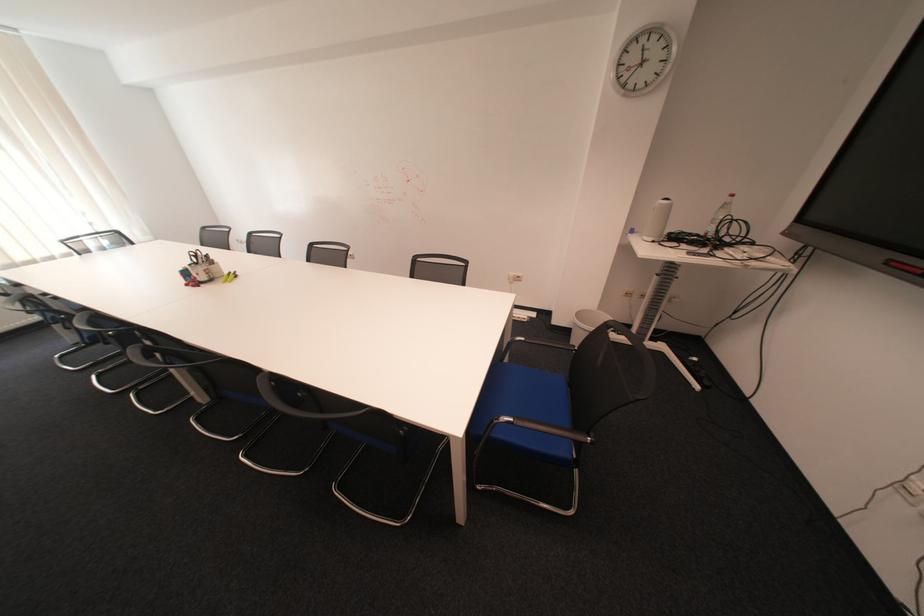
Find the location of a particular element. The width and height of the screenshot is (924, 616). plastic water bottle is located at coordinates (720, 214).